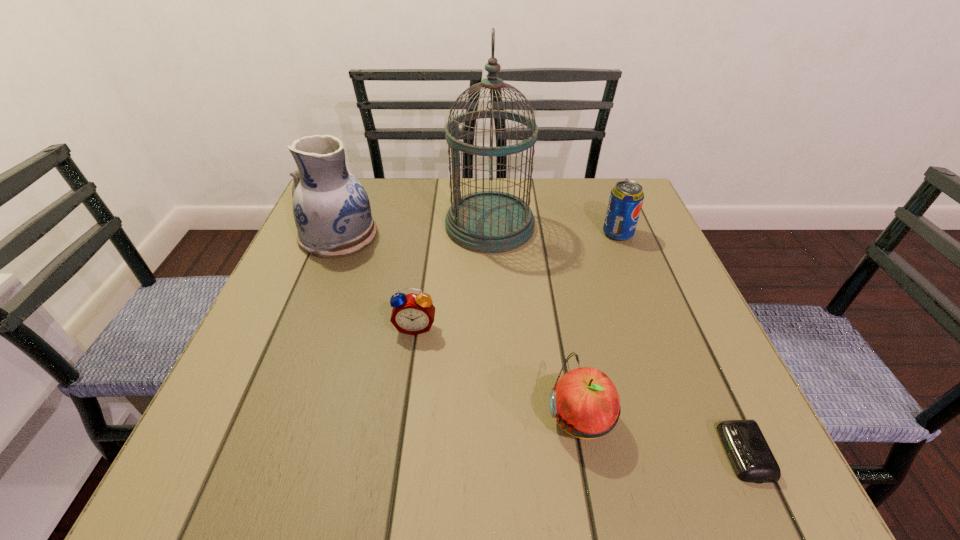
I want to click on vacant space at the far edge of the desktop, so click(x=563, y=185).

Locate an element on the screen. Image resolution: width=960 pixels, height=540 pixels. blank area at the near edge is located at coordinates (359, 488).

In the image, there is a desktop. Where is `free region at the left edge`? free region at the left edge is located at coordinates 295,326.

I want to click on free location at the right edge of the desktop, so click(658, 261).

In the image, there is a desktop. Where is `vacant space at the near left corner`? vacant space at the near left corner is located at coordinates (300, 456).

Identify the location of vacant area at the near right corner of the desktop. (699, 453).

Locate an element on the screen. The image size is (960, 540). free point between the taller alarm clock and the soda is located at coordinates (516, 280).

Find the location of a particular element. Image resolution: width=960 pixels, height=540 pixels. empty space between the nearer alarm clock and the soda is located at coordinates (681, 343).

At what (x,y) coordinates should I click in order to perform the action: click on vacant area between the fourth farthest object and the soda. Please return your answer as a coordinate pair (x, y). Looking at the image, I should click on (516, 280).

Image resolution: width=960 pixels, height=540 pixels. Identify the location of free spot between the tallest object and the leftmost object. (414, 231).